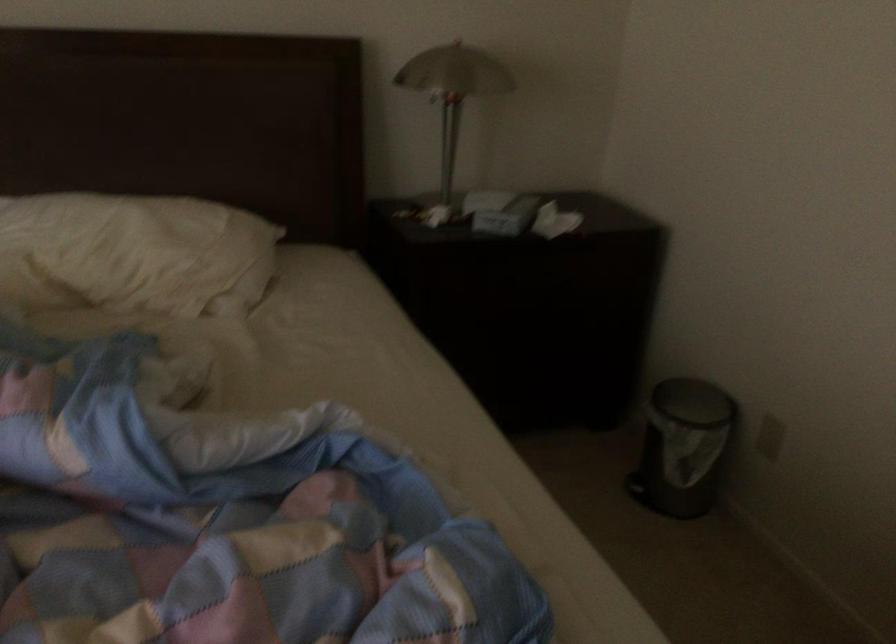
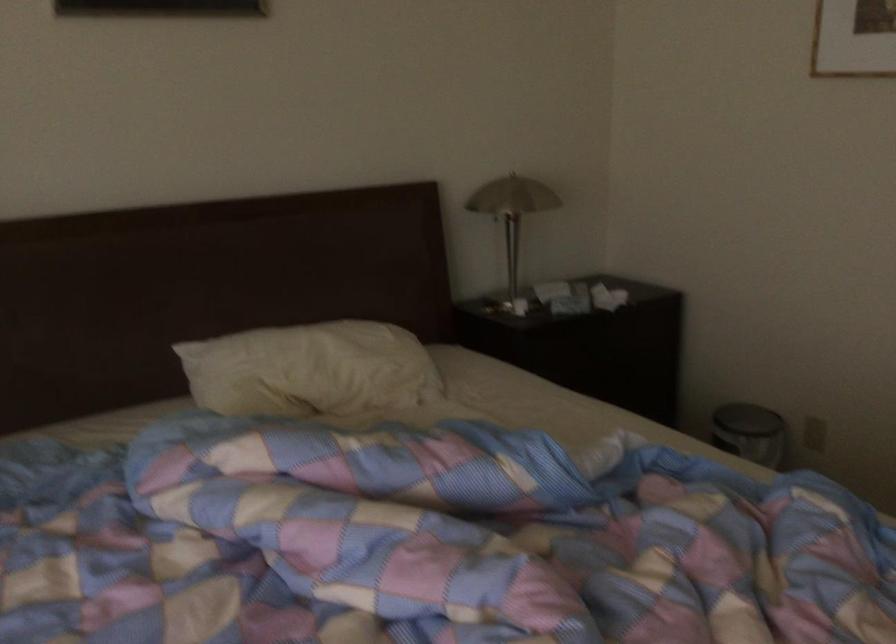
The point at (104, 254) is marked in the first image. Where is the corresponding point in the second image?

(311, 370)